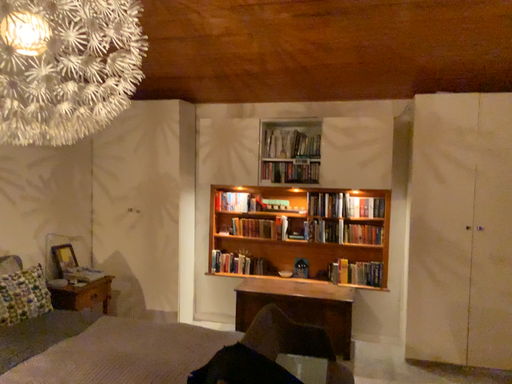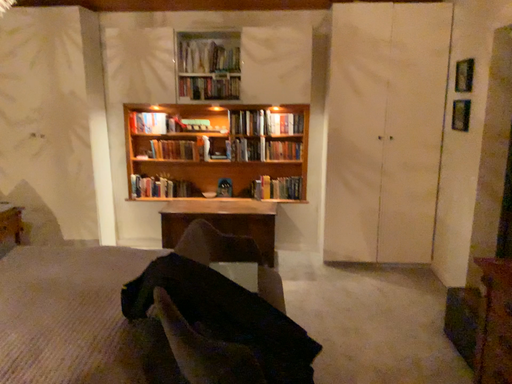
Question: Which way did the camera rotate in the video?

Choices:
 (A) rotated downward
 (B) rotated upward

Answer: (A)